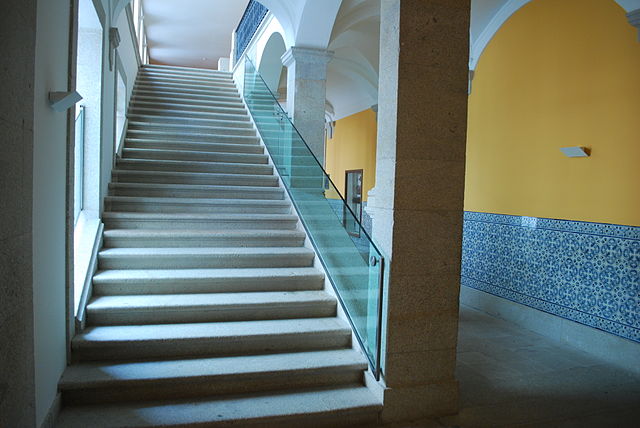
The image size is (640, 428). Identify the location of glass banister. (297, 168).